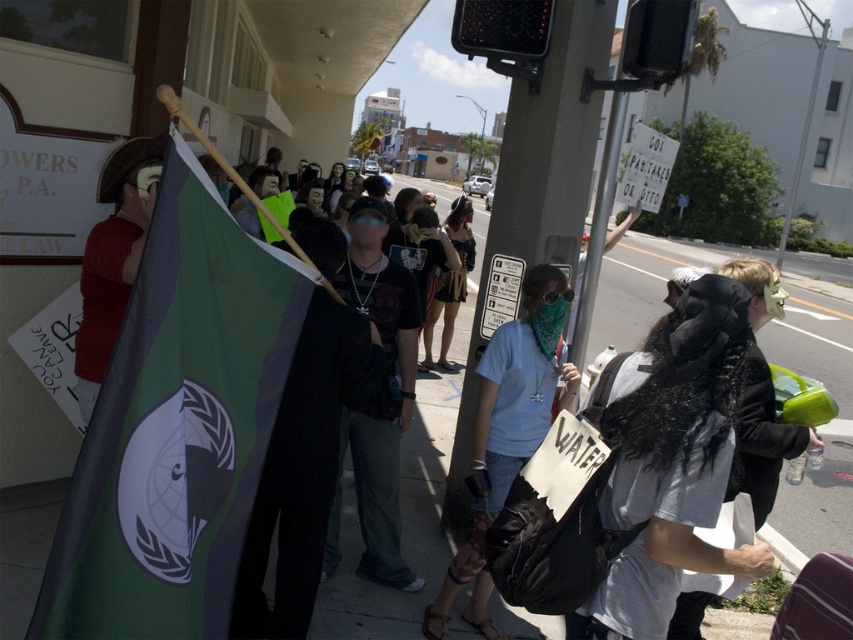
You are a photographer trying to capture a clear shot of the green fabric flag at left and the black leather jacket at center. Since you want to ensure both are visible in the frame, which object should you focus on first to account for their sizes?

The green fabric flag at left is shorter than the black leather jacket at center, so you should focus on the black leather jacket at center first as it is taller and might require more attention to ensure it fits properly in the frame.